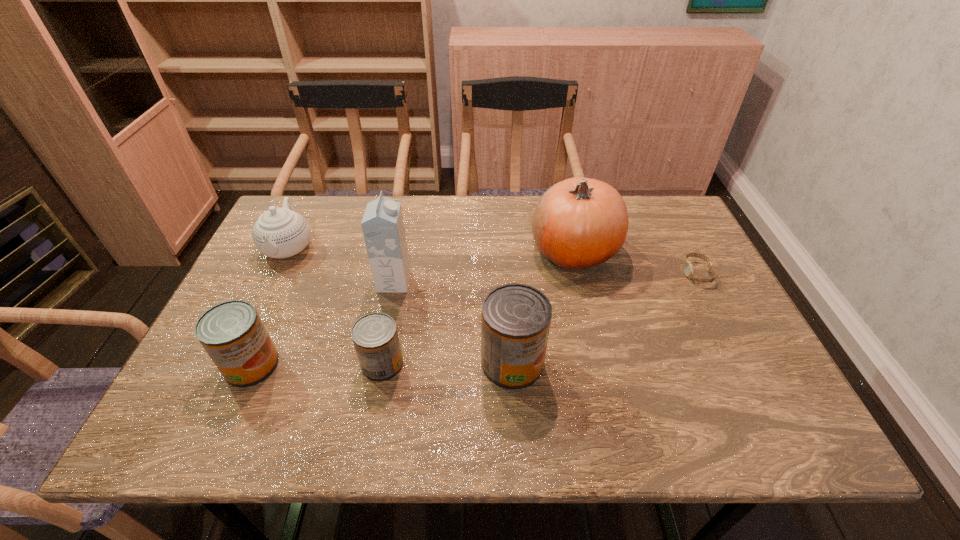
All cans are currently evenly spaced. To continue this pattern, where would you add another can on the right? Please point out a vacant spot. Please provide its 2D coordinates. Your answer should be formatted as a tuple, i.e. [(x, y)], where the tuple contains the x and y coordinates of a point satisfying the conditions above.

[(641, 361)]